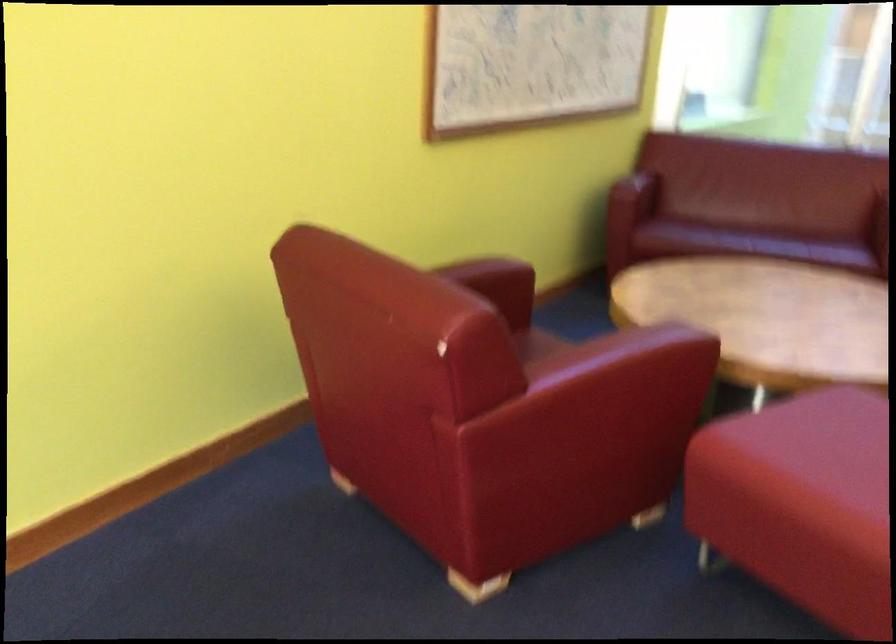
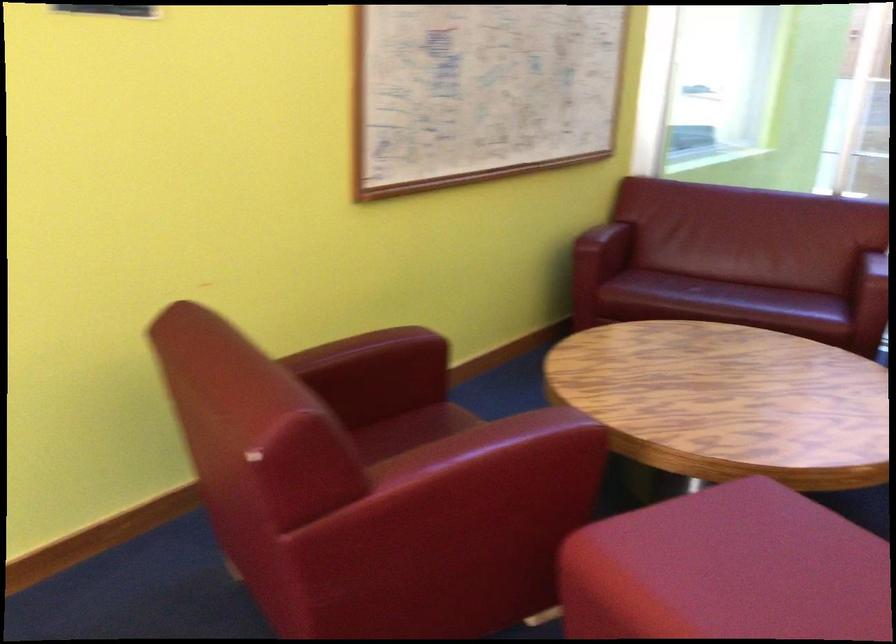
Question: The first image is from the beginning of the video and the second image is from the end. How did the camera likely rotate when shooting the video?

Choices:
 (A) Left
 (B) Right
 (C) Up
 (D) Down

Answer: (A)